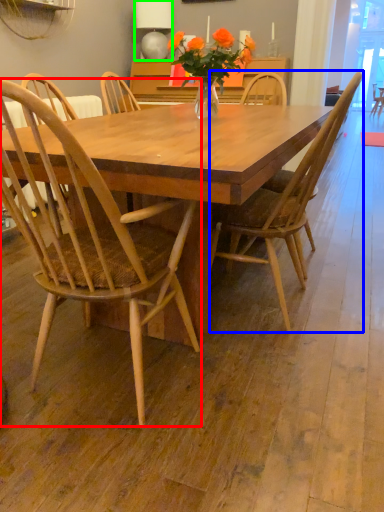
Question: Which object is positioned closest to chair (highlighted by a red box)? Select from chair (highlighted by a blue box) and lamp (highlighted by a green box).

Choices:
 (A) chair
 (B) lamp

Answer: (A)